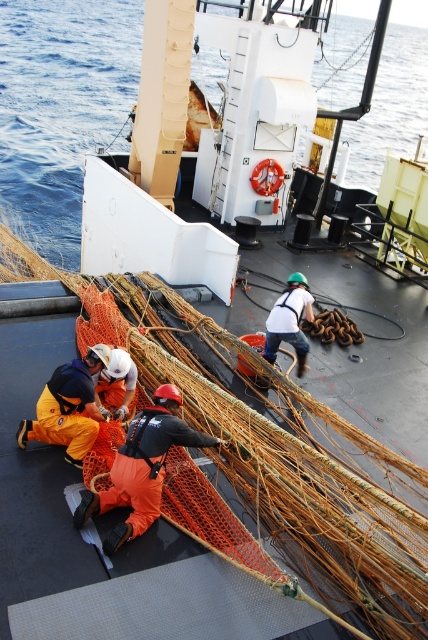
Describe the element at coordinates (68, 406) in the screenshot. This screenshot has height=640, width=428. I see `orange fabric worker at lower left` at that location.

Which of these two, orange fabric worker at lower left or orange fabric at lower left, stands taller?

Standing taller between the two is orange fabric worker at lower left.

Describe the element at coordinates (68, 406) in the screenshot. I see `orange fabric worker at lower left` at that location.

Identify the location of orange fabric worker at lower left. (68, 406).

Is the position of blue water at upper left less distant than that of orange fabric at center?

No, blue water at upper left is behind orange fabric at center.

Does blue water at upper left appear on the left side of orange fabric at center?

Yes, blue water at upper left is to the left of orange fabric at center.

Is point (47, 35) behind point (91, 506)?

Yes, point (47, 35) is farther from viewer.

You are a GUI agent. You are given a task and a screenshot of the screen. Output one action in this format:
    pyautogui.click(x=<x>, y=<y>)
    Task: Click on the blue water at upper left
    
    Given the screenshot: What is the action you would take?
    pyautogui.click(x=61, y=108)

Does blue water at upper left appear under white fabric safety harness at center?

No.

Can you confirm if blue water at upper left is smaller than white fabric safety harness at center?

Incorrect, blue water at upper left is not smaller in size than white fabric safety harness at center.

Find the location of a particular element. Image resolution: width=428 pixels, height=640 pixels. blue water at upper left is located at coordinates (61, 108).